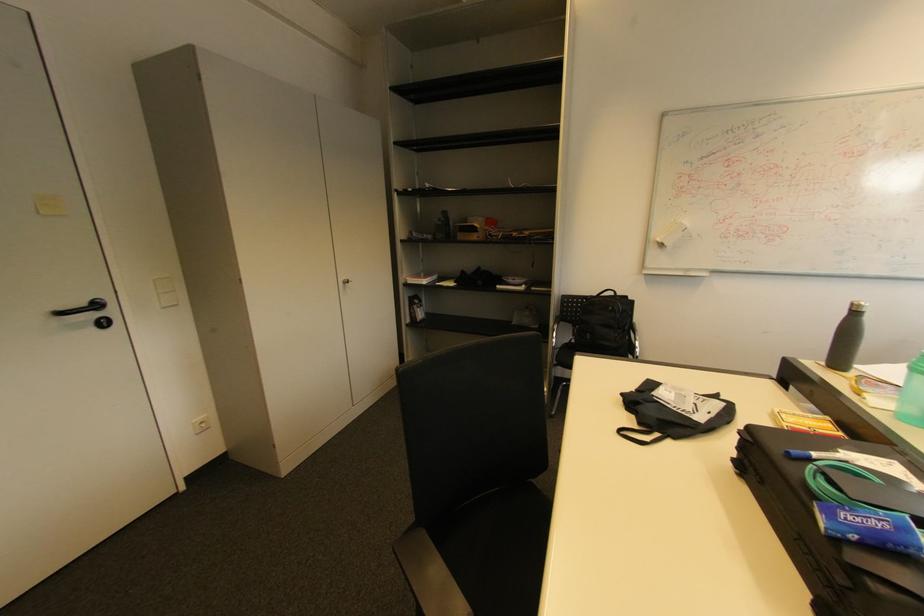
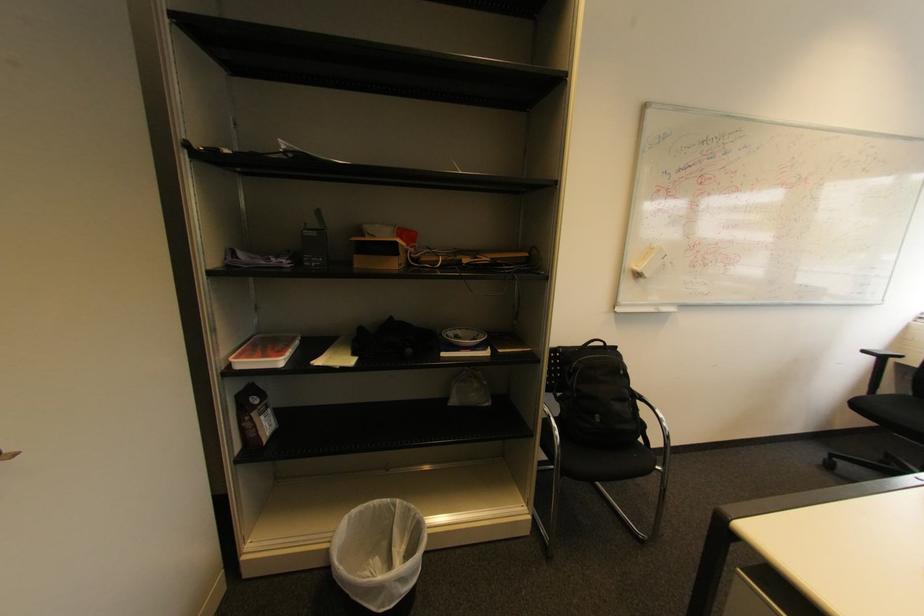
Find the pixel in the second image that matches point 479,230 in the first image.

(395, 251)